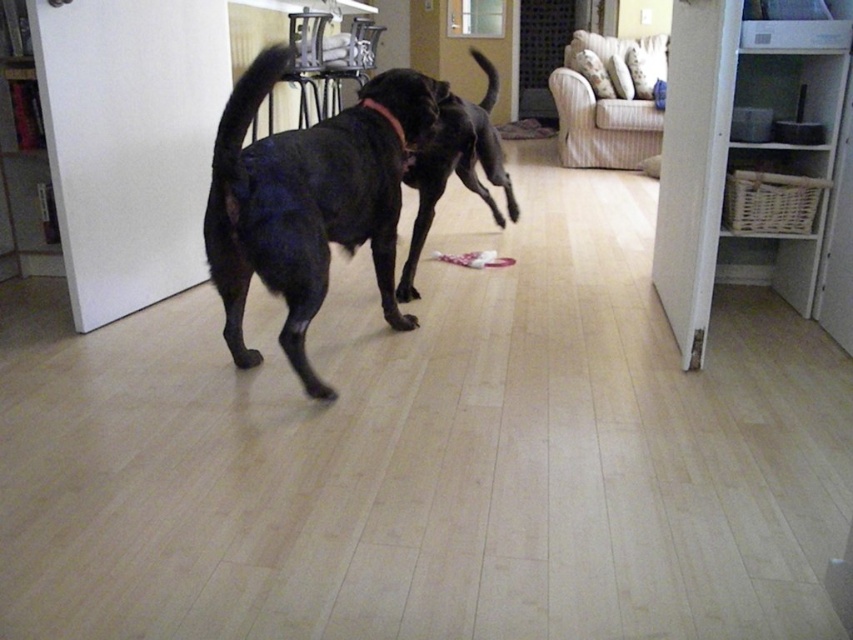
Can you confirm if shiny black dog at center is bigger than black leather neckband at center?

Yes.

Which is above, shiny black dog at center or black leather neckband at center?

black leather neckband at center is above.

Where is `shiny black dog at center`? Image resolution: width=853 pixels, height=640 pixels. shiny black dog at center is located at coordinates (308, 202).

Does black matte dog at center have a greater width compared to black leather neckband at center?

Indeed, black matte dog at center has a greater width compared to black leather neckband at center.

Is black matte dog at center taller than black leather neckband at center?

Yes.

Does point (492, 168) come behind point (392, 122)?

Yes, point (492, 168) is behind point (392, 122).

Where is `black matte dog at center`? The height and width of the screenshot is (640, 853). black matte dog at center is located at coordinates (456, 164).

I want to click on shiny black dog at center, so click(x=308, y=202).

Find the location of a particular element. This screenshot has width=853, height=640. shiny black dog at center is located at coordinates (308, 202).